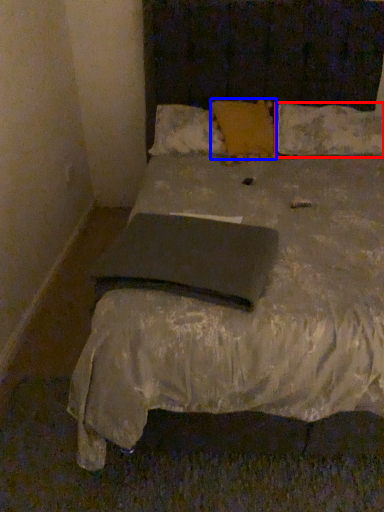
Question: Which point is closer to the camera, pillow (highlighted by a red box) or pillow (highlighted by a blue box)?

Choices:
 (A) pillow
 (B) pillow

Answer: (B)